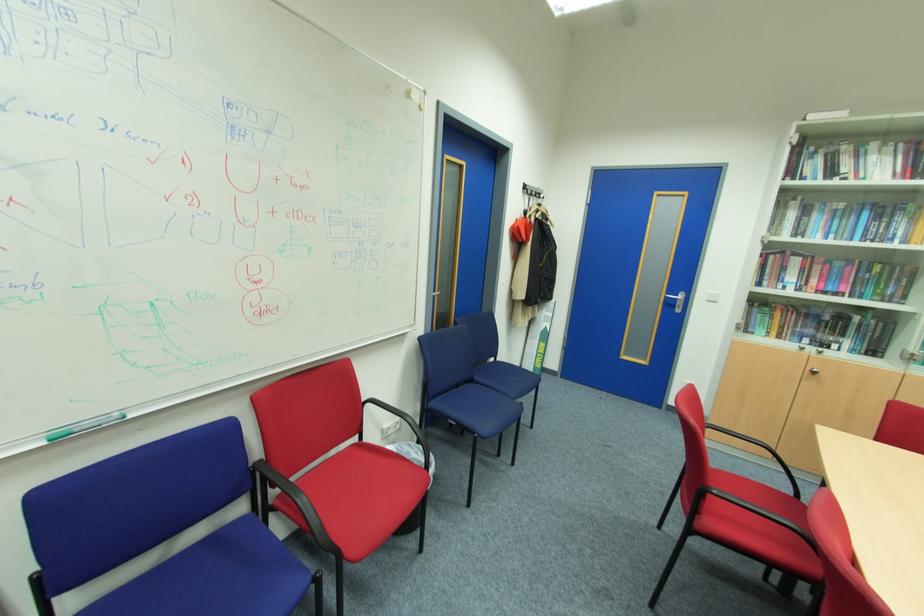
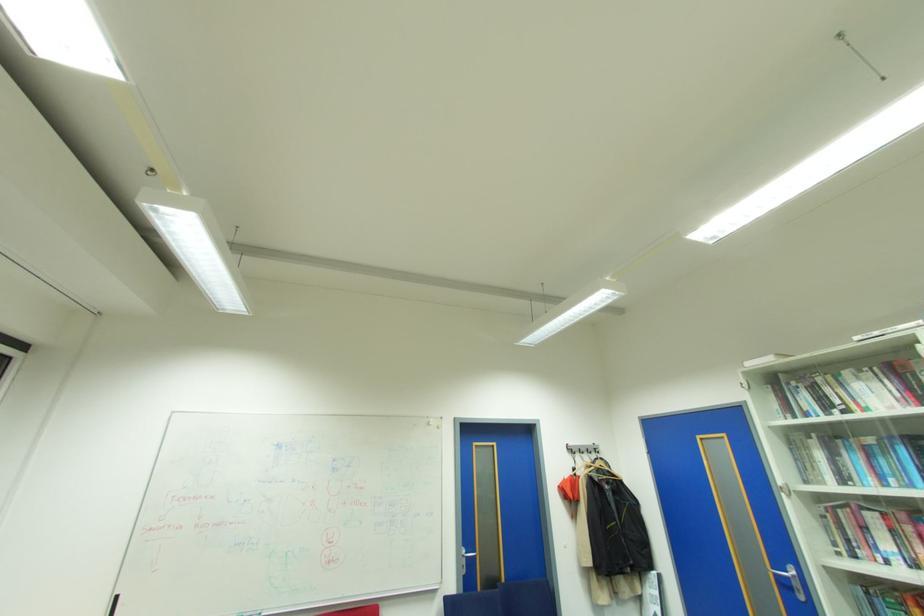
Locate, in the second image, the point that corresponds to the point at 543,193 in the first image.

(600, 448)